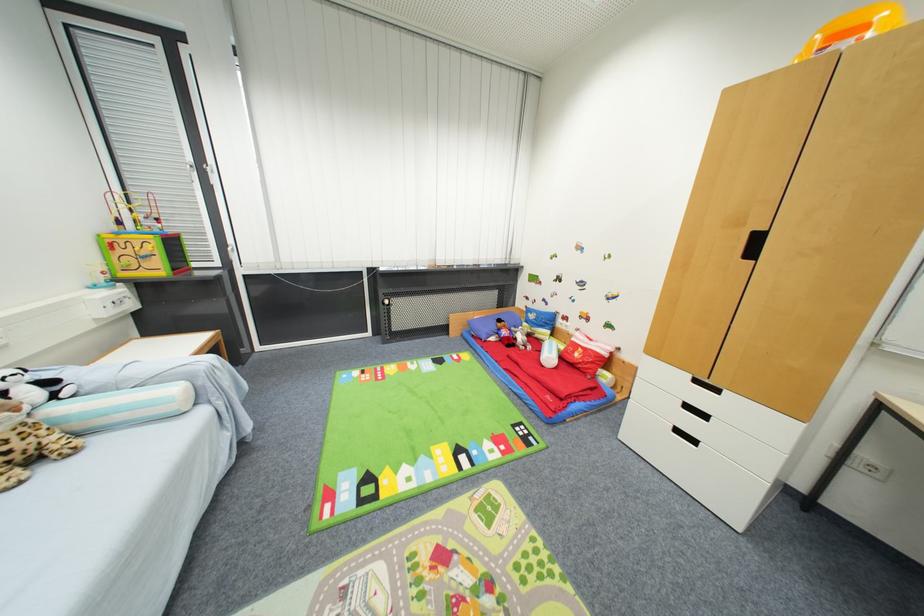
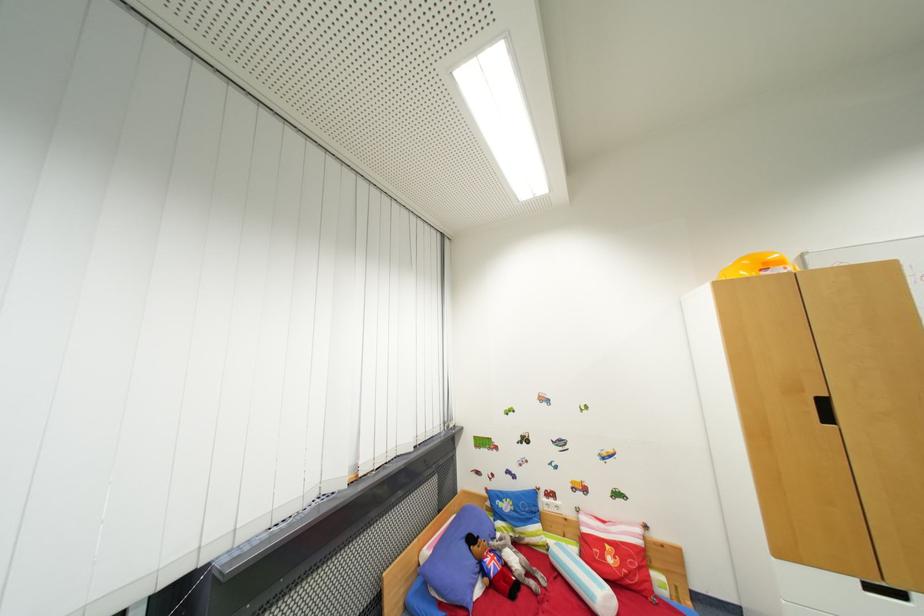
Where in the second image is the point corresponding to [757,254] from the first image?

(833, 419)